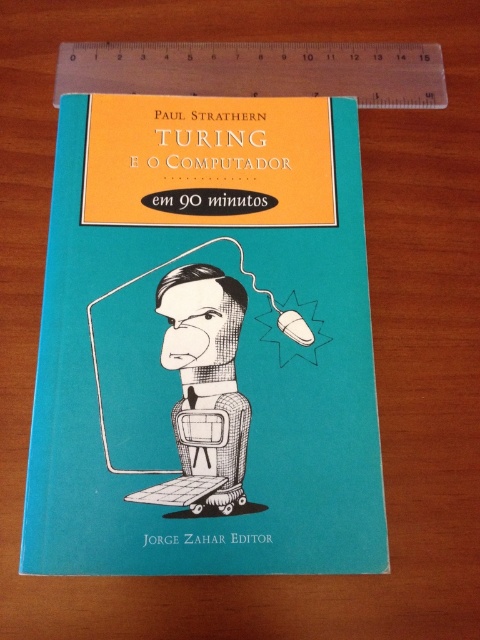
Question: Which object appears closest to the camera in this image?

Choices:
 (A) black textured robot at center
 (B) teal matte book cover at center
 (C) transparent plastic ruler at top

Answer: (B)

Question: Is teal matte book cover at center bigger than black textured robot at center?

Choices:
 (A) yes
 (B) no

Answer: (A)

Question: Which point appears closest to the camera in this image?

Choices:
 (A) (291, 42)
 (B) (172, 424)
 (C) (74, 227)

Answer: (B)

Question: From the image, what is the correct spatial relationship of teal matte book cover at center in relation to transparent plastic ruler at top?

Choices:
 (A) right
 (B) left

Answer: (B)

Question: Which of the following is the farthest from the observer?

Choices:
 (A) (230, 310)
 (B) (328, 353)

Answer: (A)

Question: Can you confirm if transparent plastic ruler at top is thinner than black textured robot at center?

Choices:
 (A) no
 (B) yes

Answer: (A)